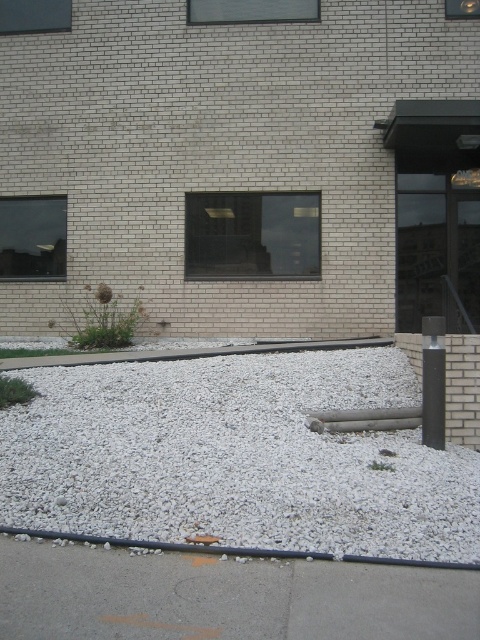
Question: Is gray concrete sidewalk at lower left to the left of black rubber curb at lower center from the viewer's perspective?

Choices:
 (A) no
 (B) yes

Answer: (B)

Question: Does white gravel at lower center appear over gray concrete sidewalk at lower left?

Choices:
 (A) no
 (B) yes

Answer: (B)

Question: Which point appears closest to the camera in this image?

Choices:
 (A) (428, 356)
 (B) (324, 596)

Answer: (B)

Question: Which of the following is the closest to the observer?

Choices:
 (A) [157, 540]
 (B) [248, 420]
 (C) [432, 428]

Answer: (A)

Question: Can you confirm if white gravel at lower center is positioned above black polished pole at right?

Choices:
 (A) no
 (B) yes

Answer: (A)

Question: Considering the real-world distances, which object is closest to the white gravel at lower center?

Choices:
 (A) gray concrete sidewalk at lower left
 (B) gray concrete curb at center
 (C) black rubber curb at lower center

Answer: (B)